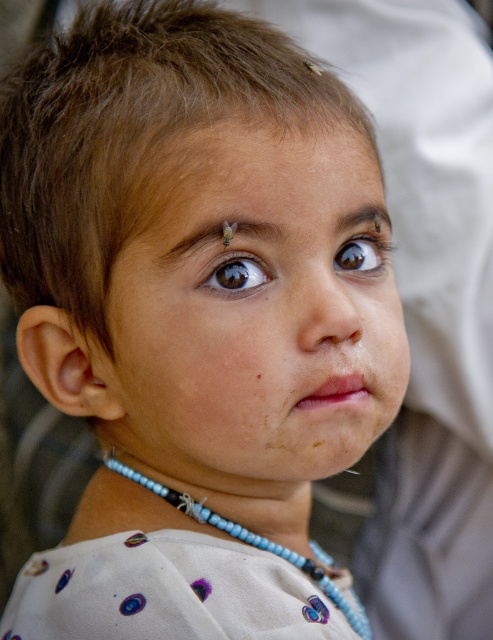
Question: Which object is the closest to the smooth skin face at center?

Choices:
 (A) blue beaded necklace at lower center
 (B) brown glossy eye at center
 (C) brown skin freckle at center

Answer: (B)

Question: Is smooth skin face at center positioned at the back of blue beaded necklace at lower center?

Choices:
 (A) yes
 (B) no

Answer: (B)

Question: Which point is closer to the camera taking this photo?

Choices:
 (A) (280, 157)
 (B) (358, 266)
 (C) (241, 276)

Answer: (C)

Question: Can you confirm if brown glossy eye at center is positioned to the right of brown skin freckle at center?

Choices:
 (A) yes
 (B) no

Answer: (A)

Question: Considering the relative positions of dry skin at center and brown matte eye at upper center in the image provided, where is dry skin at center located with respect to brown matte eye at upper center?

Choices:
 (A) right
 (B) left

Answer: (A)

Question: Estimate the real-world distances between objects in this image. Which object is closer to the smooth skin face at center?

Choices:
 (A) dry skin at center
 (B) brown glossy eye at center
 (C) blue beaded necklace at lower center

Answer: (A)